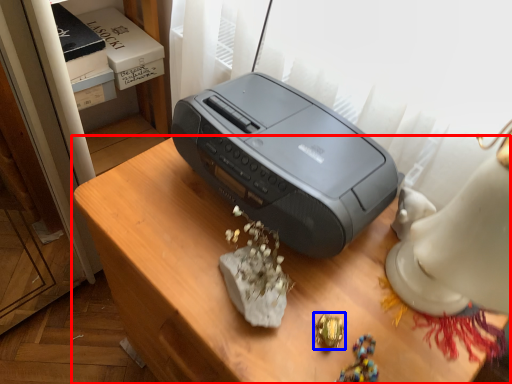
Question: Among these objects, which one is nearest to the camera, furniture (highlighted by a red box) or jewellery (highlighted by a blue box)?

Choices:
 (A) furniture
 (B) jewellery

Answer: (A)